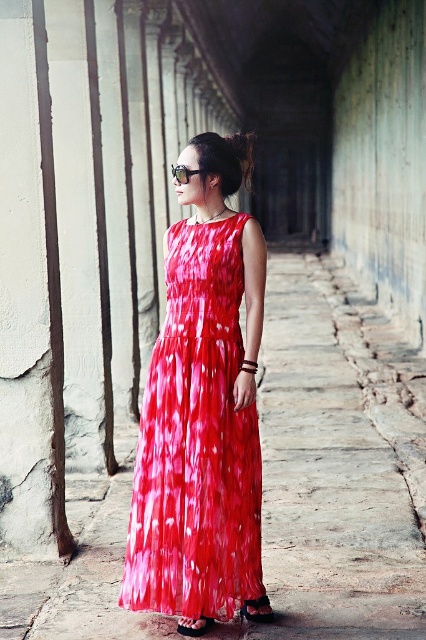
Question: Which of these objects is positioned farthest from the black leather sandal at center?

Choices:
 (A) shiny silk dress at center
 (B) smooth stone pavement at center
 (C) matte black sandal at lower center

Answer: (B)

Question: In this image, where is smooth stone pavement at center located relative to shiny silk dress at center?

Choices:
 (A) below
 (B) above

Answer: (A)

Question: Among these points, which one is farthest from the camera?

Choices:
 (A) (183, 616)
 (B) (265, 618)
 (C) (342, 621)
 (D) (186, 628)

Answer: (B)

Question: Which object is farther from the camera taking this photo?

Choices:
 (A) black leather sandal at center
 (B) matte black sandal at lower center
 (C) smooth stone pavement at center
 (D) shiny silk dress at center

Answer: (B)

Question: Does shiny silk dress at center appear on the left side of black leather sandal at center?

Choices:
 (A) yes
 (B) no

Answer: (B)

Question: Considering the relative positions of smooth stone pavement at center and shiny silk dress at center in the image provided, where is smooth stone pavement at center located with respect to shiny silk dress at center?

Choices:
 (A) right
 (B) left

Answer: (A)